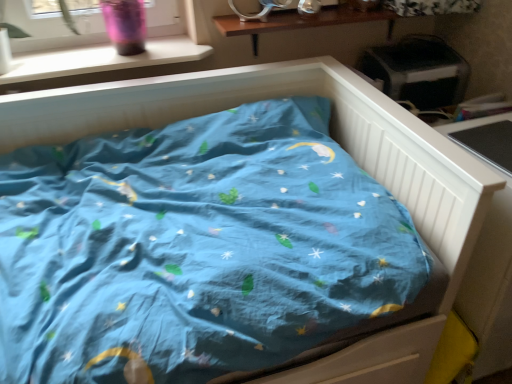
Where is `free space above white plastic window sill at upper left (from a real-world perspective)`? free space above white plastic window sill at upper left (from a real-world perspective) is located at coordinates (103, 54).